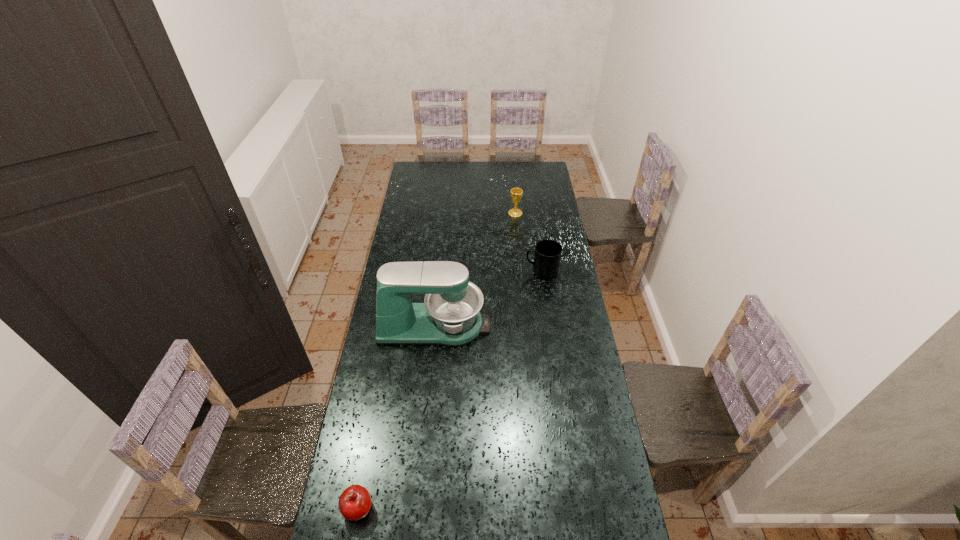
Find the location of a particular element. The width and height of the screenshot is (960, 540). vacant area located 0.050m on the side of the mug with the handle is located at coordinates (515, 272).

Locate an element on the screen. free space located 0.310m on the back of the apple is located at coordinates (377, 403).

At what (x,y) coordinates should I click in order to perform the action: click on mixer present at the left edge. Please return your answer as a coordinate pair (x, y). The image size is (960, 540). Looking at the image, I should click on (449, 316).

Where is `apple located in the left edge section of the desktop`? apple located in the left edge section of the desktop is located at coordinates (354, 503).

Where is `object that is positioned at the right edge`? This screenshot has height=540, width=960. object that is positioned at the right edge is located at coordinates (547, 257).

In the image, there is a desktop. Where is `free space at the far edge`? This screenshot has width=960, height=540. free space at the far edge is located at coordinates (503, 163).

Where is `vacant region at the left edge of the desktop`? vacant region at the left edge of the desktop is located at coordinates (425, 238).

Where is `vacant space at the right edge of the desktop`? The height and width of the screenshot is (540, 960). vacant space at the right edge of the desktop is located at coordinates (561, 354).

Where is `free area in between the farthest object and the third nearest object`? Image resolution: width=960 pixels, height=540 pixels. free area in between the farthest object and the third nearest object is located at coordinates (528, 242).

What are the coordinates of `free space between the farthest object and the mug` in the screenshot? It's located at (528, 242).